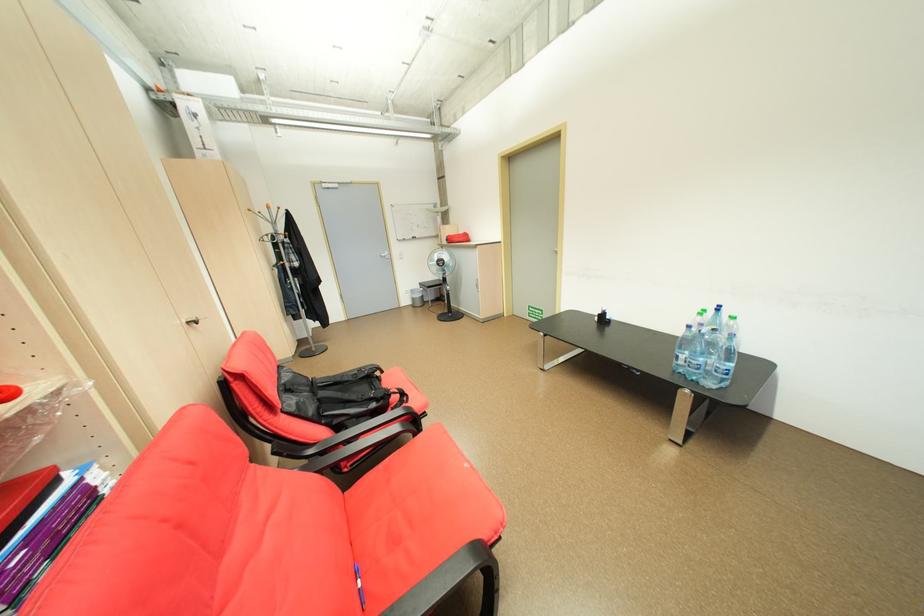
Where would you pull the silver cabinet handle? Please return your answer as a coordinate pair (x, y).

(193, 322)